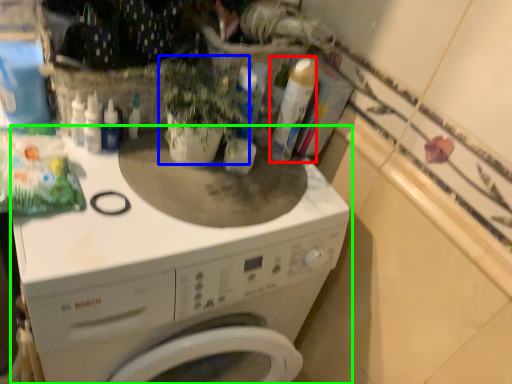
Question: Estimate the real-world distances between objects in this image. Which object is farther from cleaning product (highlighted by a red box), plant (highlighted by a blue box) or washing machine (highlighted by a green box)?

Choices:
 (A) plant
 (B) washing machine

Answer: (B)